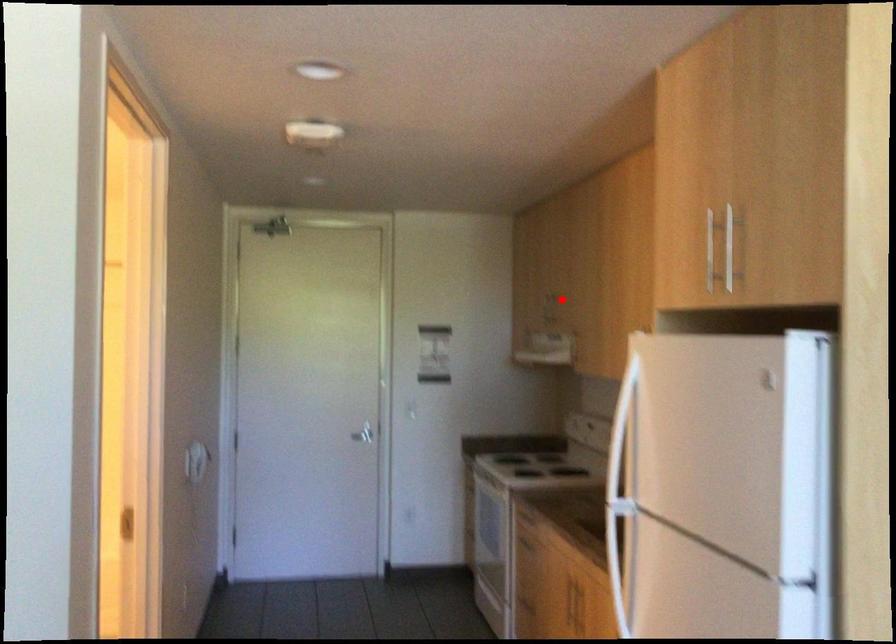
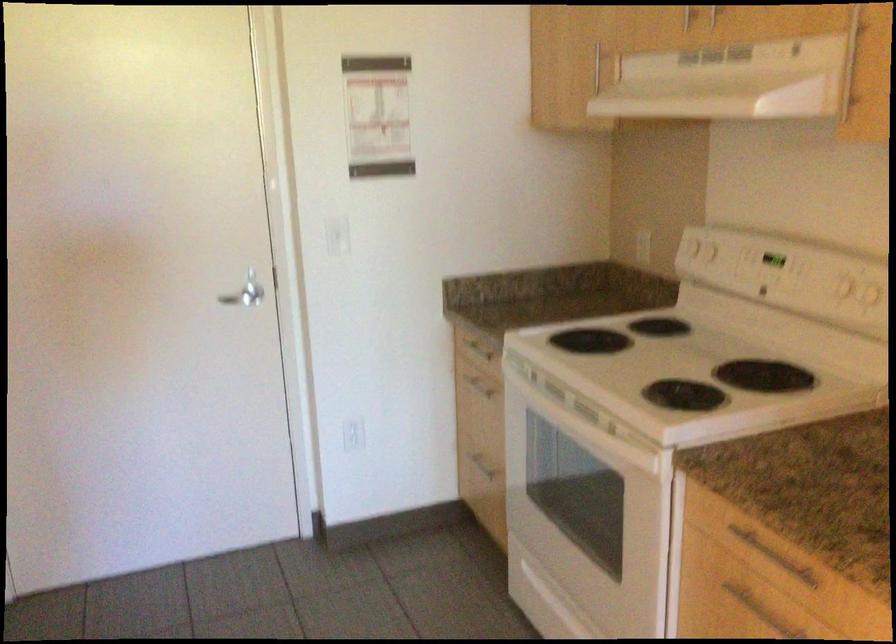
Locate, in the second image, the point that corresponds to the highlighted location in the first image.

(714, 15)